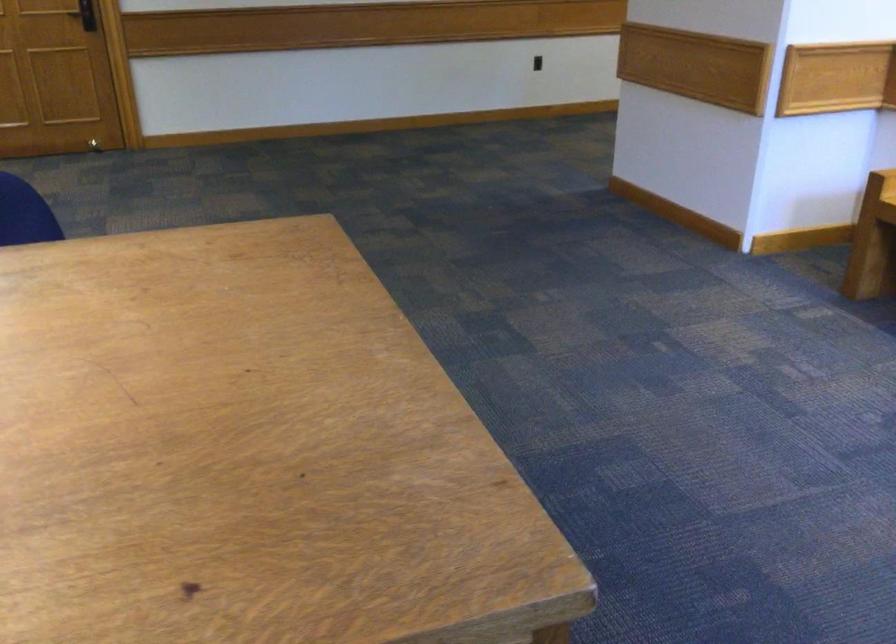
Where is `metal door handle`? The height and width of the screenshot is (644, 896). metal door handle is located at coordinates (85, 15).